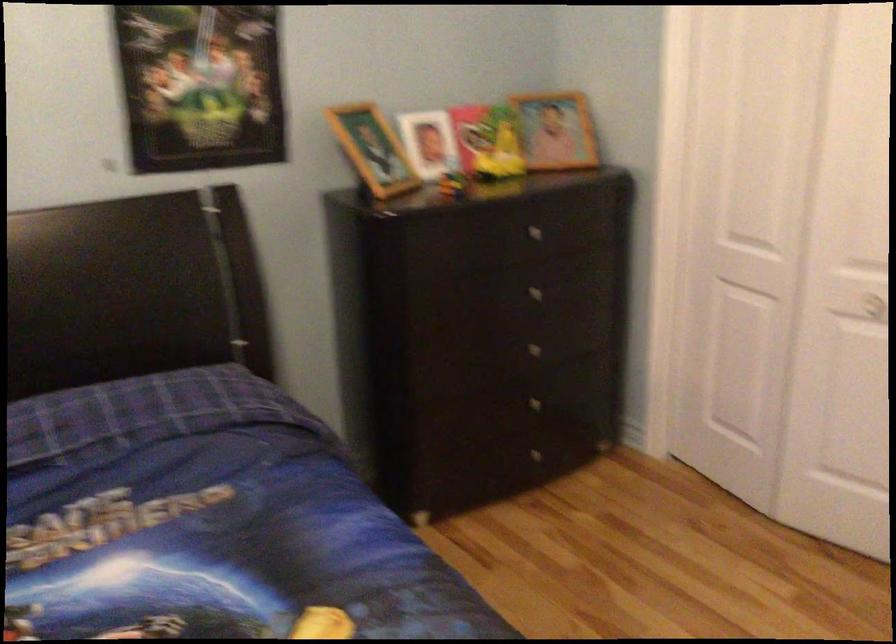
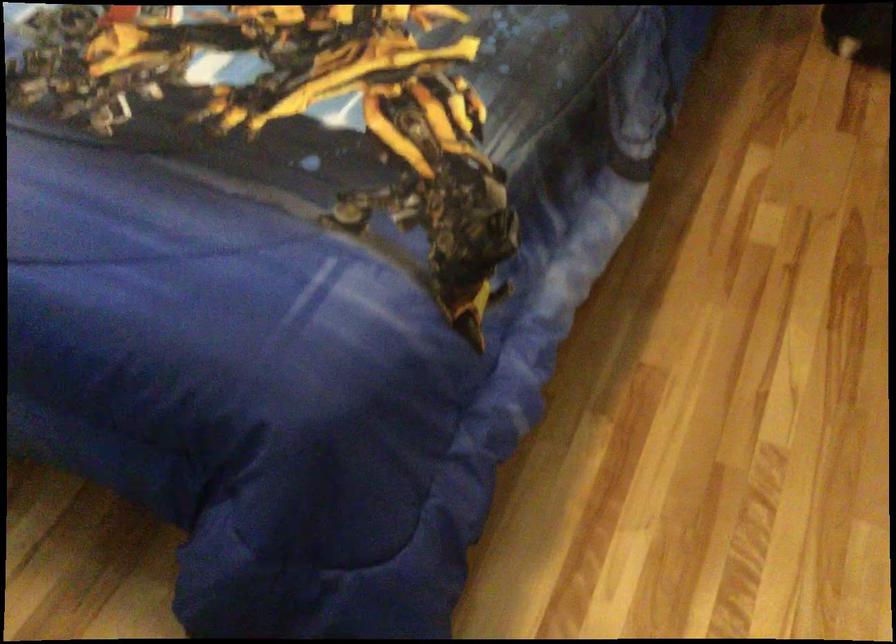
Based on the continuous images, in which direction is the camera rotating?

The camera rotated toward left-down.